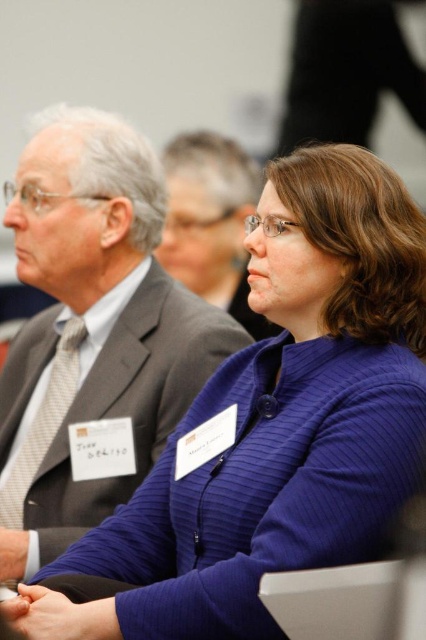
You are standing in the room and see the point at coordinates [5,484]. If you want to place a small object there, will it be within your immediate reach? Assume your arm can extend 5 feet.

The point at coordinates [5,484] is 6.79 feet away from the viewer, which is beyond the 5 feet arm reach. Therefore, placing the object there would require moving closer.